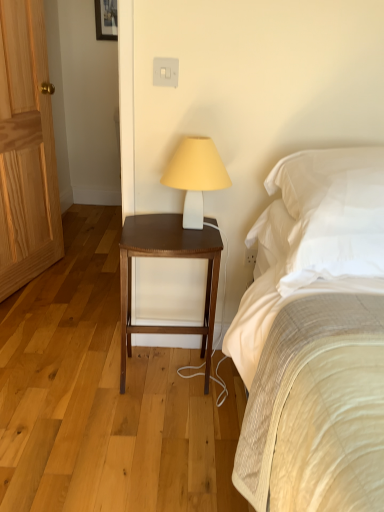
At what (x,y) coordinates should I click in order to perform the action: click on free spot below white matte table lamp at upper center (from a real-world perspective). Please return your answer as a coordinate pair (x, y). Looking at the image, I should click on (193, 230).